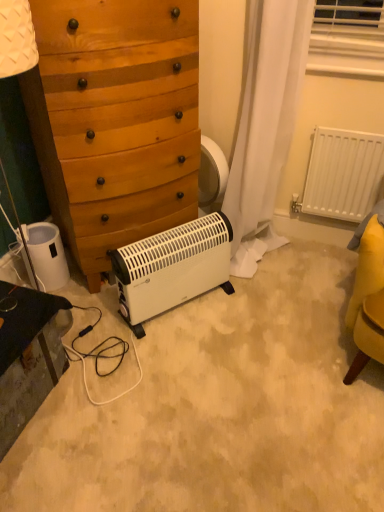
This screenshot has width=384, height=512. Find the location of `vacant space underneath white plastic radiator at right (from a real-world perspective)`. vacant space underneath white plastic radiator at right (from a real-world perspective) is located at coordinates (325, 248).